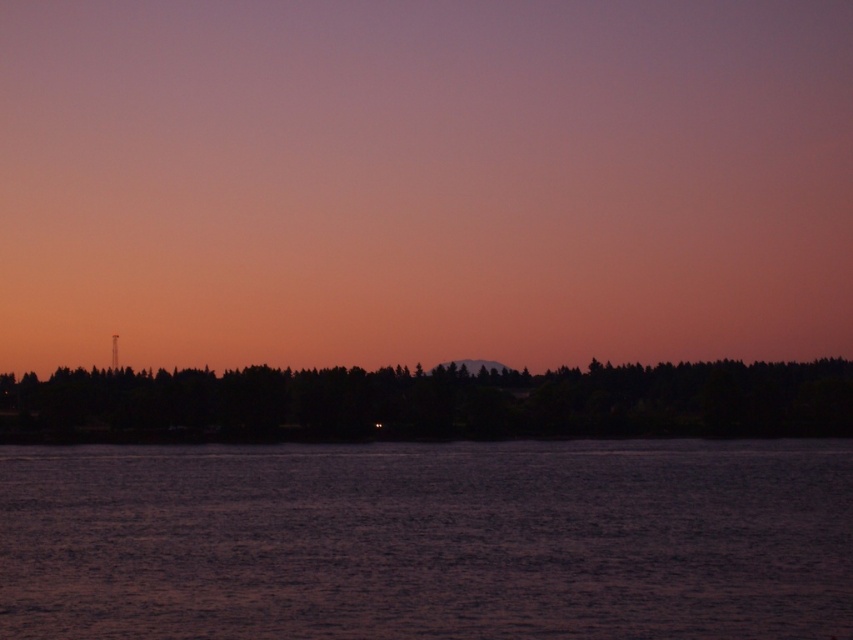
You are an artist painting the sunset scene. You need to decide which area to focus on first based on their sizes. Which object is narrower between the dark purple water at center and the dark green trees at center?

The dark purple water at center is thinner than the dark green trees at center, so the dark purple water at center is narrower and should be focused on first.

You are a kayaker planning to paddle from the dark purple water at center to the dark green trees at center. Given that your kayak can travel 50 meters in one hour, how long will it take you to reach the trees?

The distance between the dark purple water at center and the dark green trees at center is 47.46 meters. Since your kayak can travel 50 meters in an hour, it will take approximately 57 minutes to reach the trees.